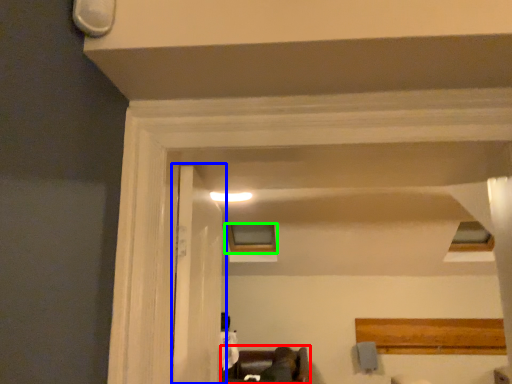
Question: Which is nearer to the furniture (highlighted by a red box)? door (highlighted by a blue box) or window (highlighted by a green box).

Choices:
 (A) door
 (B) window

Answer: (B)